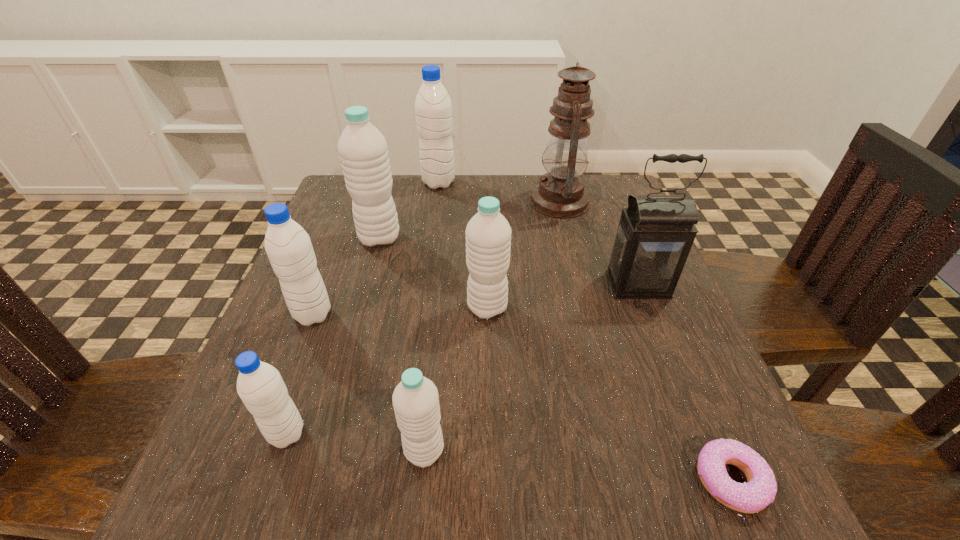
Locate an element on the screen. The height and width of the screenshot is (540, 960). vacant area that lies between the sixth object from left to right and the lantern is located at coordinates (563, 296).

The image size is (960, 540). Identify the location of free area in between the rightmost water bottle and the second farthest gray water bottle. (400, 311).

Locate an element on the screen. The height and width of the screenshot is (540, 960). free point between the second nearest white water bottle and the nearest white water bottle is located at coordinates (456, 379).

The height and width of the screenshot is (540, 960). I want to click on free space between the rightmost gray water bottle and the rightmost white water bottle, so click(463, 245).

Locate an element on the screen. This screenshot has width=960, height=540. free space between the second biggest white water bottle and the smallest white water bottle is located at coordinates (456, 379).

Locate which object ranks sixth in proximity to the lantern. Please provide its 2D coordinates. Your answer should be formatted as a tuple, i.e. [(x, y)], where the tuple contains the x and y coordinates of a point satisfying the conditions above.

[(433, 107)]

This screenshot has height=540, width=960. In order to click on object that is the eighth nearest to the second smallest gray water bottle in this screenshot , I will do `click(760, 490)`.

This screenshot has height=540, width=960. I want to click on the third closest water bottle to the oil lamp, so click(x=363, y=150).

Point out which water bottle is positioned as the sixth nearest to the oil lamp. Please provide its 2D coordinates. Your answer should be formatted as a tuple, i.e. [(x, y)], where the tuple contains the x and y coordinates of a point satisfying the conditions above.

[(260, 386)]

At what (x,y) coordinates should I click in order to perform the action: click on the third closest gray water bottle to the oil lamp. Please return your answer as a coordinate pair (x, y). This screenshot has height=540, width=960. Looking at the image, I should click on (260, 386).